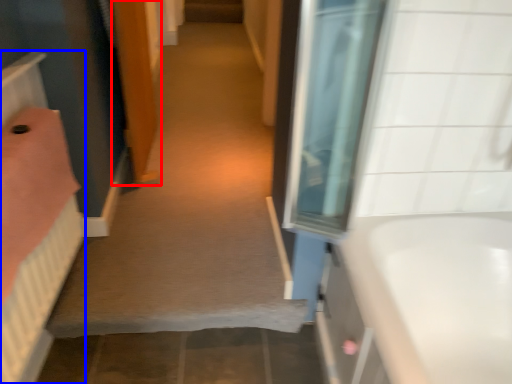
Question: Which object appears closest to the camera in this image, door (highlighted by a red box) or bed (highlighted by a blue box)?

Choices:
 (A) door
 (B) bed

Answer: (B)